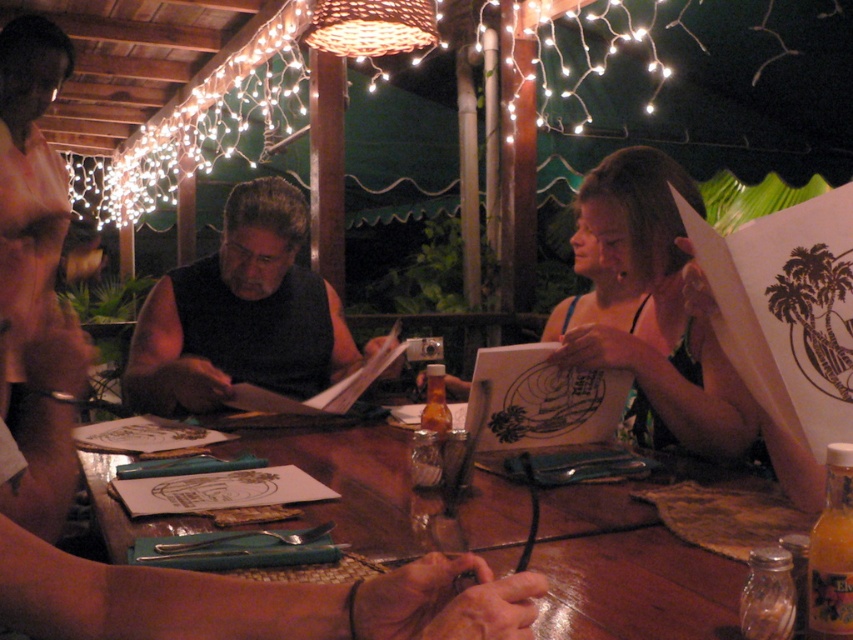
You are a server at this outdoor dining area and need to deliver a drink to the guest wearing the black matte shirt at center. The drink is currently on the wooden table at center. Can you reach the drink without moving around the table?

The wooden table at center is positioned on the right side of black matte shirt at center, so the drink on the wooden table at center is to the guest right side. The guest can reach it without needing to move around the table.

Based on the photo, you are a photographer taking a picture of the wooden table at center and the matte green bikini top at upper right. To ensure both are in frame, should you adjust your camera to the left or right?

The wooden table at center is to the left of the matte green bikini top at upper right, so you should adjust your camera to the right to include both in the frame.